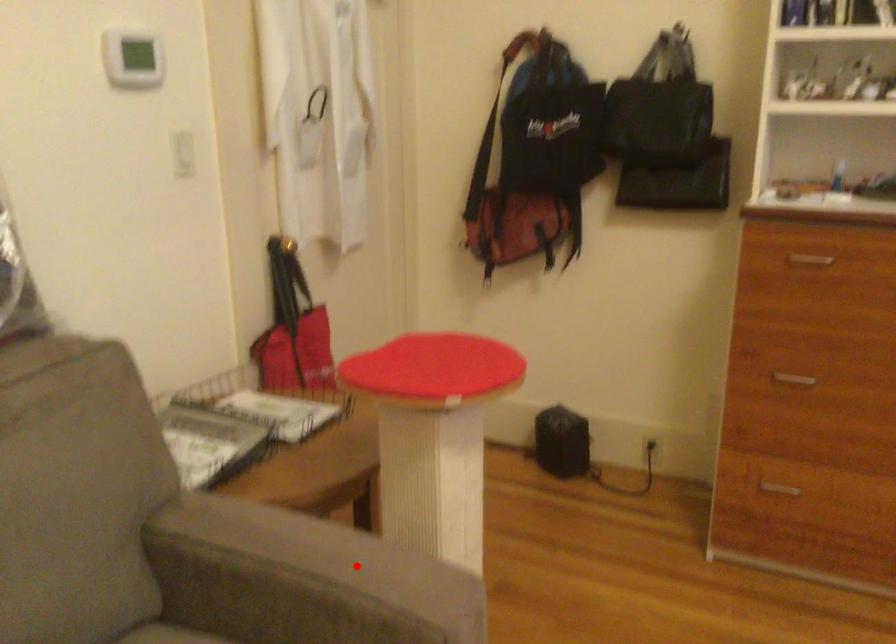
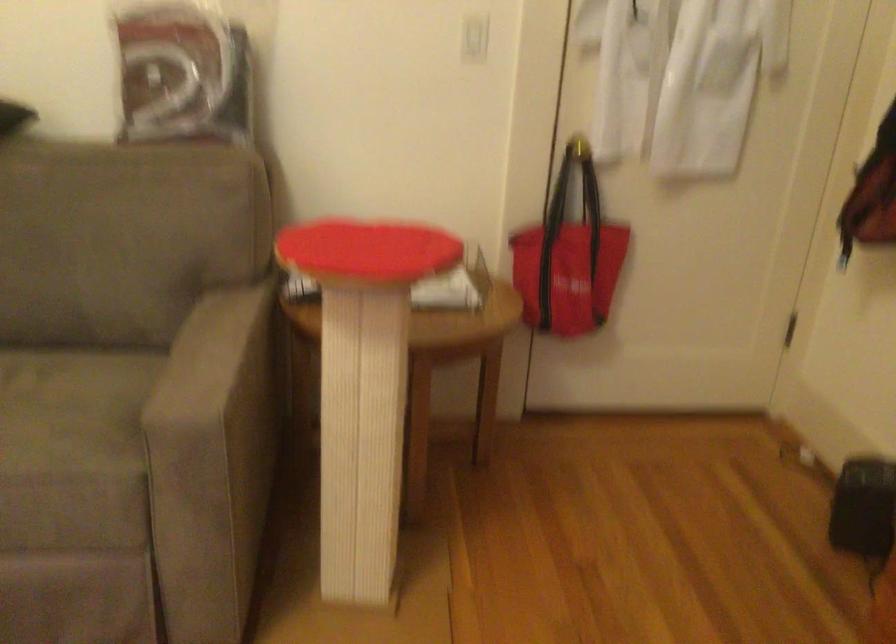
Locate, in the second image, the point that corresponds to the highlighted location in the first image.

(212, 360)